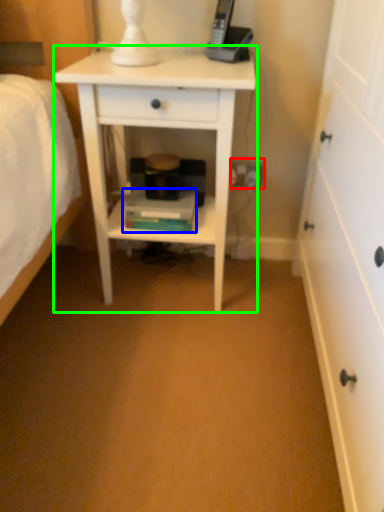
Question: Which object is the farthest from electric outlet (highlighted by a red box)? Choose among these: book (highlighted by a blue box) or nightstand (highlighted by a green box).

Choices:
 (A) book
 (B) nightstand

Answer: (B)